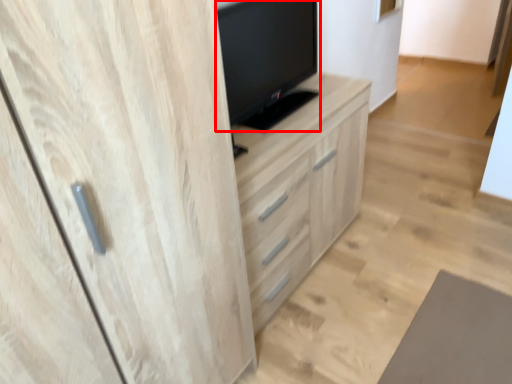
Question: Where is television (annotated by the red box) located in relation to chest of drawers in the image?

Choices:
 (A) right
 (B) left

Answer: (B)